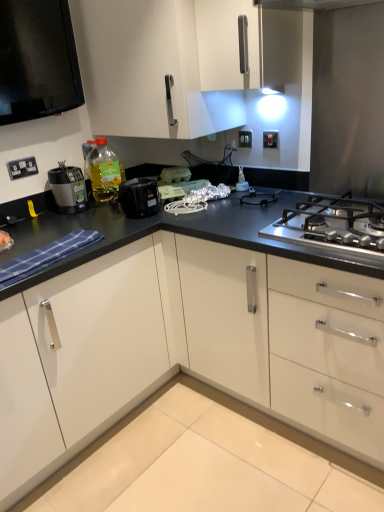
Question: Is white plastic electric outlet at upper center, which is the 2th electric outlet from left to right, inside or outside of white glossy cabinet at upper center?

Choices:
 (A) outside
 (B) inside

Answer: (A)

Question: Is white plastic electric outlet at upper center, which is counted as the first electric outlet, starting from the back, wider or thinner than white glossy cabinet at upper center?

Choices:
 (A) thin
 (B) wide

Answer: (A)

Question: Which object is positioned closest to the black plastic slow cooker at center?

Choices:
 (A) matte black food processor at left
 (B) white glossy cabinet at upper center
 (C) white plastic electrical outlet at upper left, the 3th electric outlet positioned from the top
 (D) matte plastic container at center, acting as the 1th appliance starting from the left
 (E) white plastic toaster at center, arranged as the second appliance when viewed from the right

Answer: (E)

Question: Based on their relative distances, which object is farther from the translucent yellow bottle at upper left?

Choices:
 (A) white plastic toaster at center, arranged as the second appliance when viewed from the right
 (B) white plastic switch at upper right, which ranks as the first electric outlet in right-to-left order
 (C) stainless steel gas stove at right
 (D) matte plastic kettle at center, the third appliance when ordered from left to right
 (E) black plastic slow cooker at center

Answer: (C)